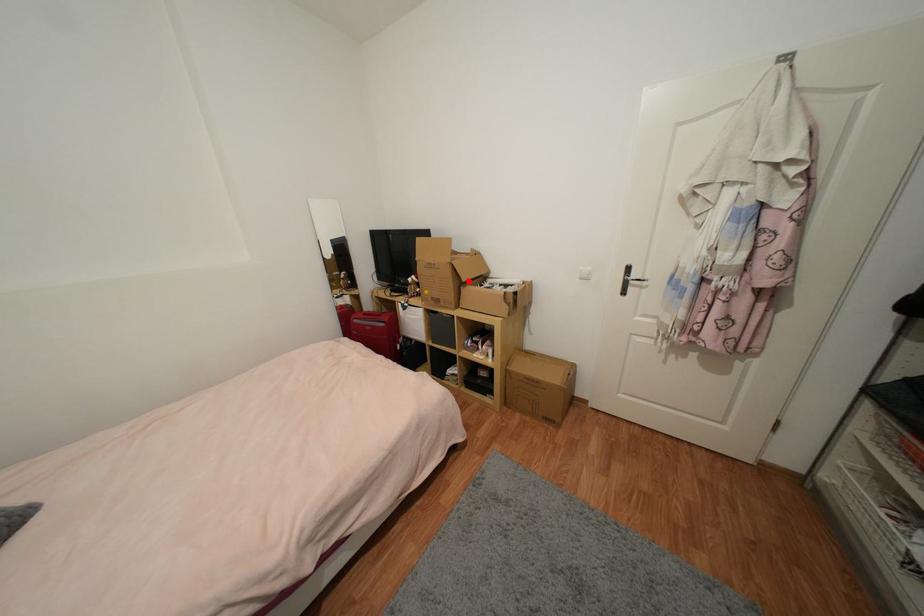
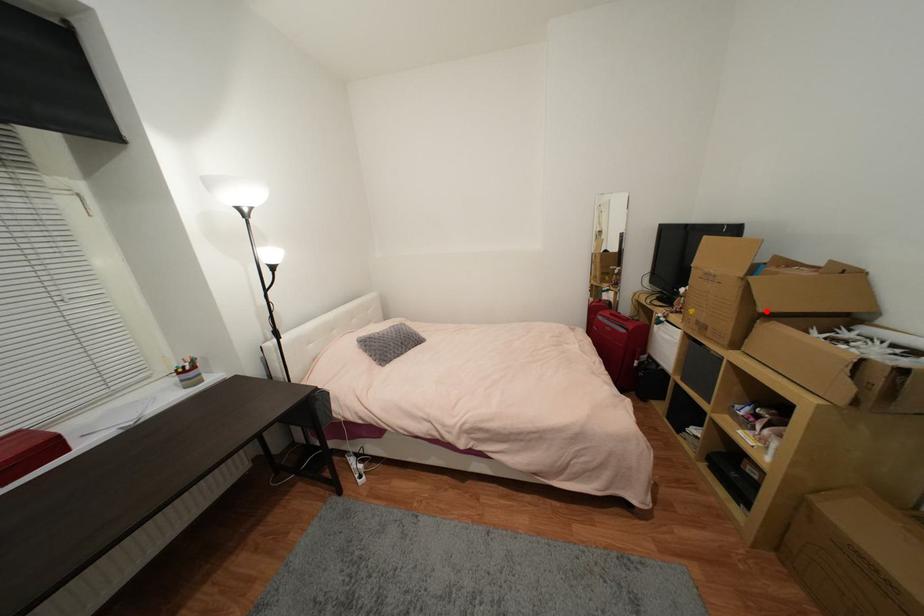
I am providing you with two images of the same scene from different viewpoints. A red point is marked on the first image and another point is marked on the second image. Are the points marked in image1 and image2 representing the same 3D position?

Yes